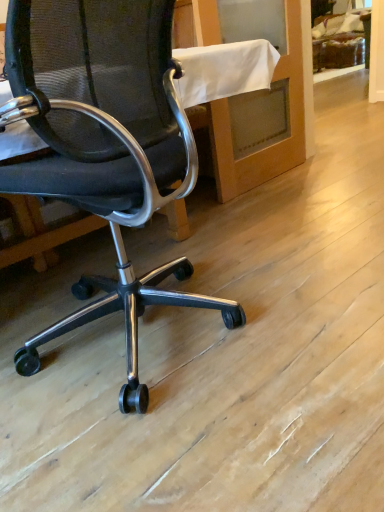
The height and width of the screenshot is (512, 384). Find the location of `unoccupied region to the right of matte black office chair at left`. unoccupied region to the right of matte black office chair at left is located at coordinates (308, 310).